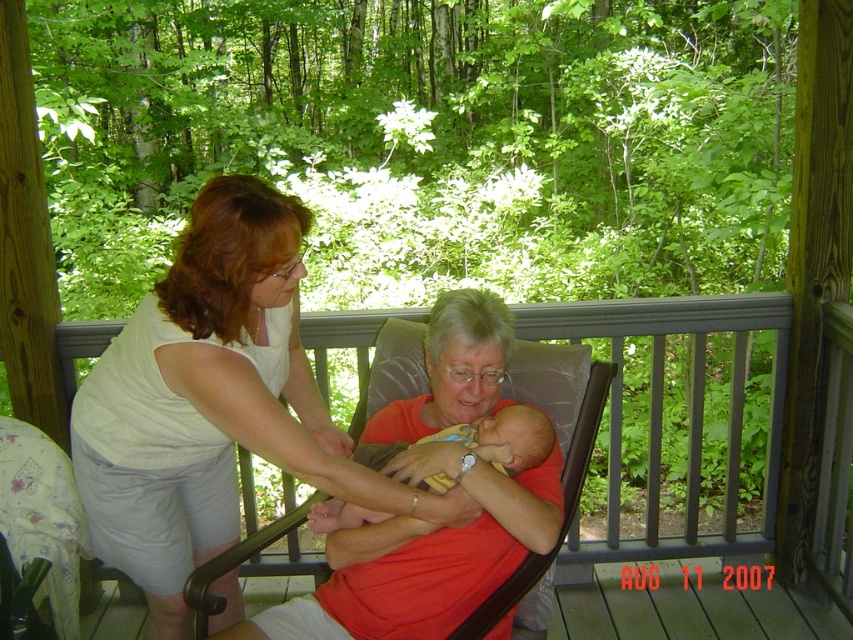
Question: Does brown leather chair at center have a larger size compared to soft yellow fabric baby at center?

Choices:
 (A) yes
 (B) no

Answer: (A)

Question: Which point is closer to the camera taking this photo?

Choices:
 (A) (512, 467)
 (B) (701, 308)
 (C) (579, 445)

Answer: (A)

Question: Does gray fabric chair at center appear under soft yellow fabric baby at center?

Choices:
 (A) no
 (B) yes

Answer: (A)

Question: Which of the following is the farthest from the observer?

Choices:
 (A) gray fabric chair at center
 (B) soft yellow fabric baby at center
 (C) brown leather chair at center

Answer: (C)

Question: Which point is farther to the camera?

Choices:
 (A) (422, 317)
 (B) (514, 452)
 (C) (654, 429)

Answer: (C)

Question: Does gray fabric chair at center have a smaller size compared to soft yellow fabric baby at center?

Choices:
 (A) no
 (B) yes

Answer: (A)